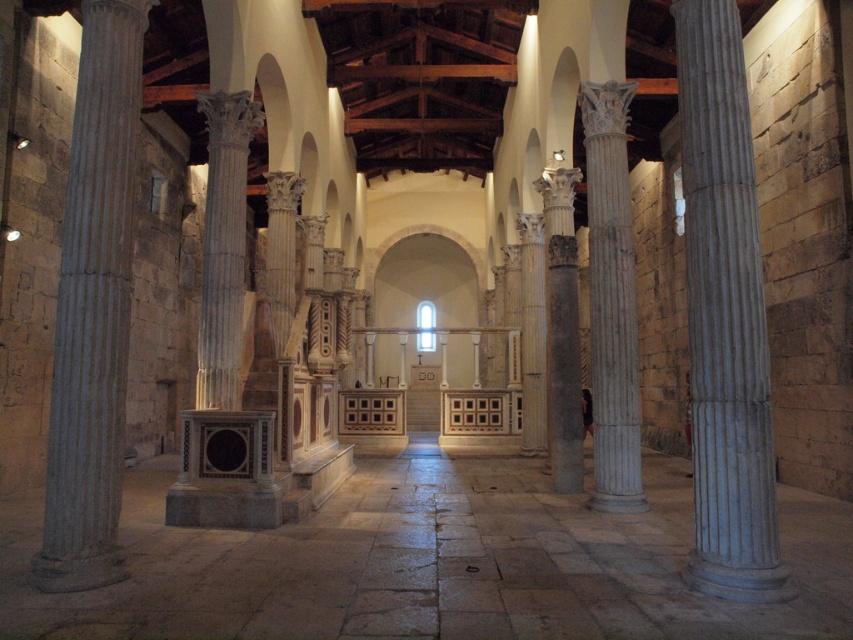
Who is positioned more to the left, gray marble column at right or white marble column at left?

white marble column at left is more to the left.

Image resolution: width=853 pixels, height=640 pixels. What do you see at coordinates (724, 316) in the screenshot? I see `gray marble column at right` at bounding box center [724, 316].

Image resolution: width=853 pixels, height=640 pixels. I want to click on gray marble column at right, so click(x=724, y=316).

I want to click on gray marble column at right, so click(x=724, y=316).

Which is behind, point (767, 588) or point (608, 273)?

Point (608, 273)

Identify the location of gray marble column at right. This screenshot has width=853, height=640. (724, 316).

Can you confirm if white marble floor at center is shorter than white marble column at center?

Yes.

Is white marble floor at center to the left of white marble column at center from the viewer's perspective?

Yes, white marble floor at center is to the left of white marble column at center.

Find the location of a particular element. Image resolution: width=853 pixels, height=640 pixels. white marble floor at center is located at coordinates (431, 564).

I want to click on white marble floor at center, so click(431, 564).